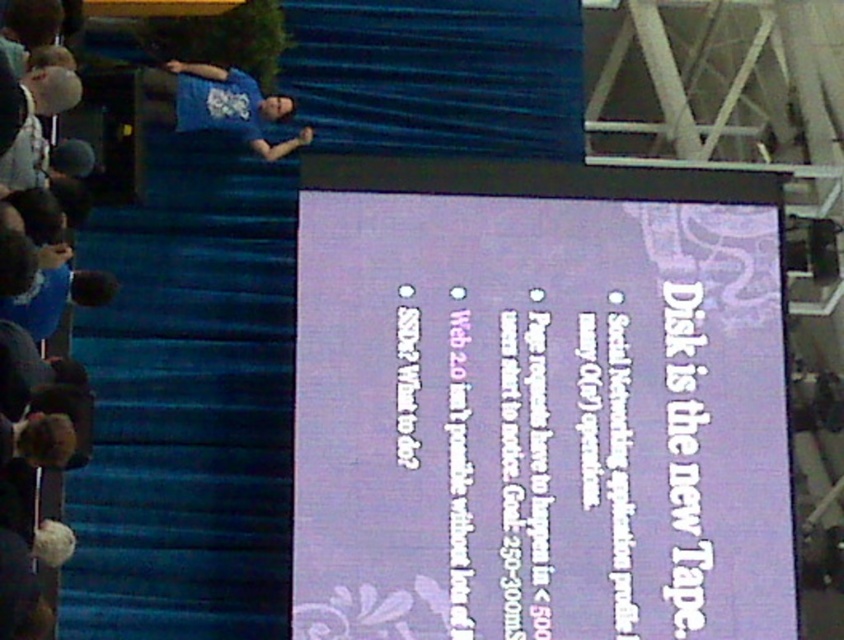
Does purple glossy projection screen at center come in front of blue t-shirt at left?

No, purple glossy projection screen at center is further to the viewer.

The image size is (844, 640). What do you see at coordinates (539, 403) in the screenshot? I see `purple glossy projection screen at center` at bounding box center [539, 403].

Does point (778, 632) come closer to viewer compared to point (12, 246)?

No, it is behind (12, 246).

Identify the location of purple glossy projection screen at center. (539, 403).

Between blue t-shirt at left and blue t-shirt at upper left, which one is positioned higher?

blue t-shirt at upper left

Is blue t-shirt at left to the right of blue t-shirt at upper left from the viewer's perspective?

Incorrect, blue t-shirt at left is not on the right side of blue t-shirt at upper left.

The width and height of the screenshot is (844, 640). Describe the element at coordinates (46, 388) in the screenshot. I see `blue t-shirt at left` at that location.

You are a GUI agent. You are given a task and a screenshot of the screen. Output one action in this format:
    pyautogui.click(x=<x>, y=<y>)
    Task: Click on the blue t-shirt at left
    
    Given the screenshot: What is the action you would take?
    pyautogui.click(x=46, y=388)

Is purple glossy projection screen at center shorter than blue t-shirt at upper left?

No.

Is point (733, 355) farther from viewer compared to point (252, 106)?

No.

At what (x,y) coordinates should I click in order to perform the action: click on purple glossy projection screen at center. Please return your answer as a coordinate pair (x, y). The image size is (844, 640). Looking at the image, I should click on (539, 403).